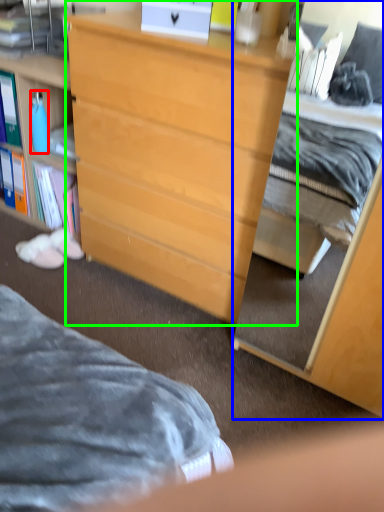
Question: Which object is positioned farthest from bottle (highlighted by a red box)? Select from cabinetry (highlighted by a blue box) and desk (highlighted by a green box).

Choices:
 (A) cabinetry
 (B) desk

Answer: (A)